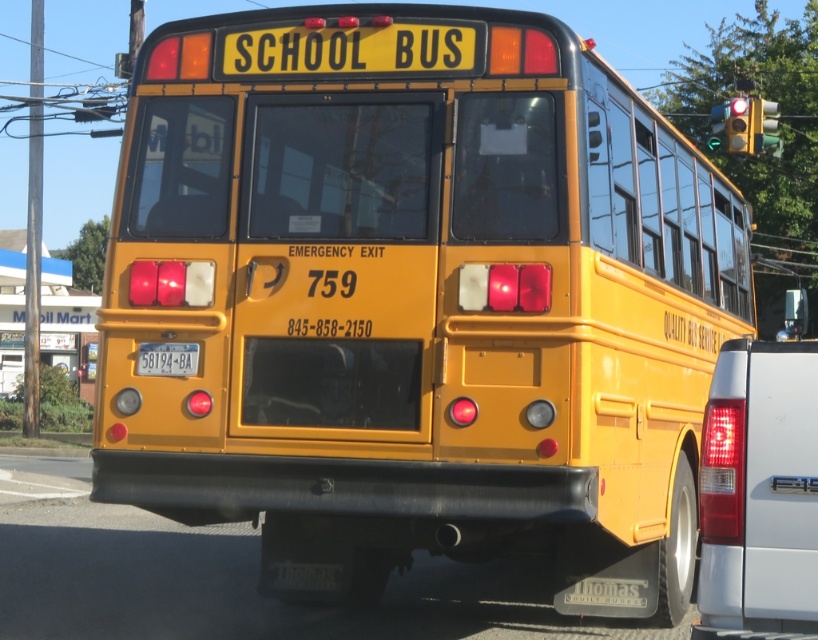
You are a driver approaching the rear of the school bus. You notice the matte white tail light at rear and the yellow plastic license plate at center. Which object is taller?

The matte white tail light at rear is much taller than the yellow plastic license plate at center.

You are a driver approaching the rear of the classic yellow school bus. You notice the matte white tail light at rear and the yellow plastic license plate at center. Which object is bigger?

The matte white tail light at rear is larger in size than the yellow plastic license plate at center.